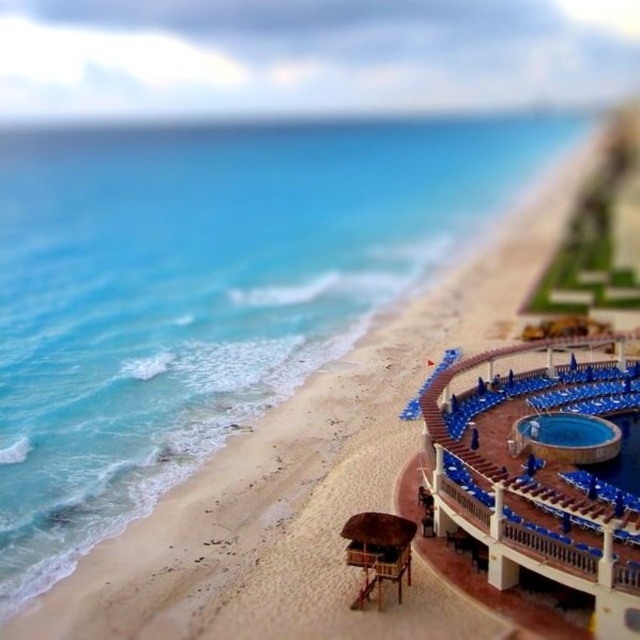
Question: Does blue glossy pool at lower right appear over blue glossy pool at center right?

Choices:
 (A) yes
 (B) no

Answer: (A)

Question: Which of the following is the closest to the observer?

Choices:
 (A) blue plastic lounge chairs at lower right
 (B) blue glossy pool at center right
 (C) blue glossy pool at lower right

Answer: (A)

Question: Is the position of blue plastic lounge chairs at lower right less distant than that of blue glossy pool at lower right?

Choices:
 (A) no
 (B) yes

Answer: (B)

Question: Which point appears farthest from the camera in this image?

Choices:
 (A) (632, 410)
 (B) (445, 401)
 (C) (596, 442)

Answer: (A)

Question: Can you confirm if blue glossy pool at lower right is positioned to the right of blue glossy pool at center right?

Choices:
 (A) no
 (B) yes

Answer: (B)

Question: Which object is positioned farthest from the blue glossy pool at center right?

Choices:
 (A) blue plastic lounge chairs at lower right
 (B) blue glossy pool at lower right

Answer: (A)